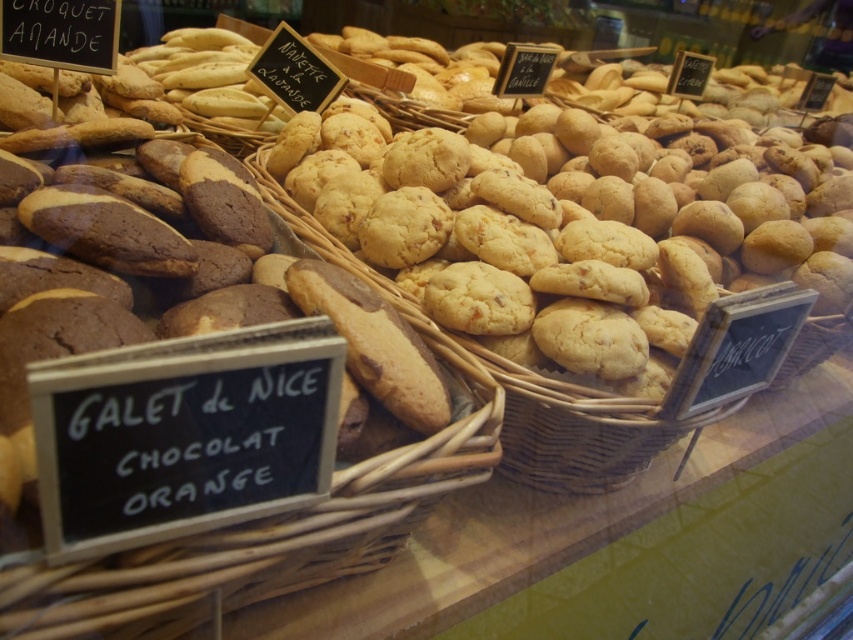
Between golden-brown wicker basket at center and brown wicker basket at center, which one is positioned lower?

brown wicker basket at center is lower down.

Between golden-brown wicker basket at center and brown wicker basket at center, which one is positioned higher?

golden-brown wicker basket at center is higher up.

Between point (683, 420) and point (36, 582), which one is positioned behind?

The point (683, 420) is behind.

Find the location of a particular element. The width and height of the screenshot is (853, 640). golden-brown wicker basket at center is located at coordinates (540, 275).